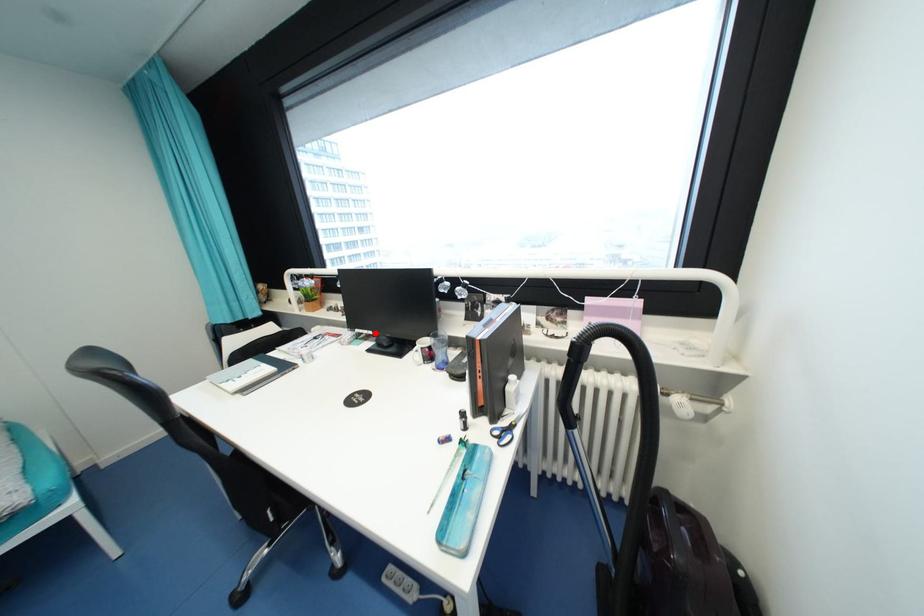
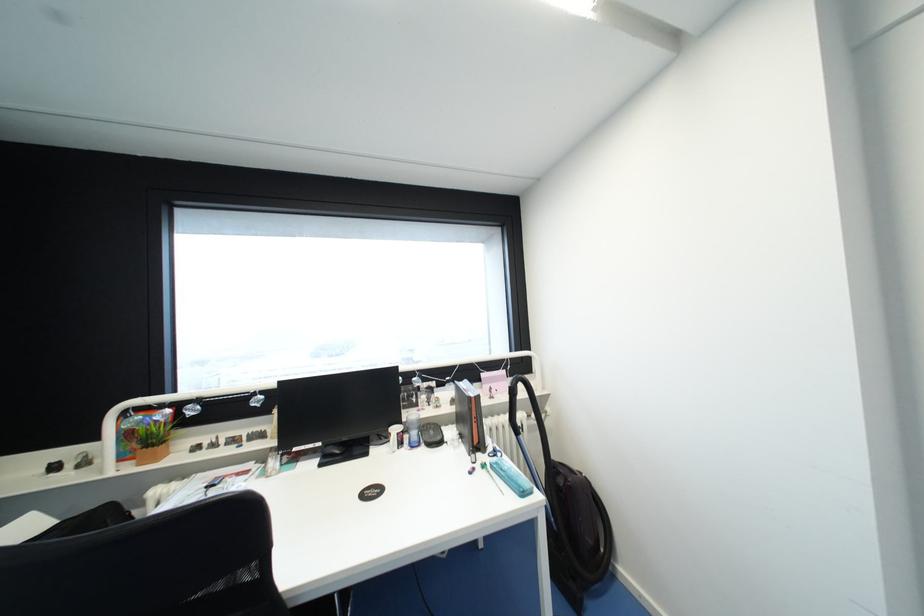
Question: I am providing you with two images of the same scene from different viewpoints. In image1, a red point is highlighted. Considering the same 3D point in image2, which of the following is correct?

Choices:
 (A) It is closer
 (B) It is farther

Answer: (B)